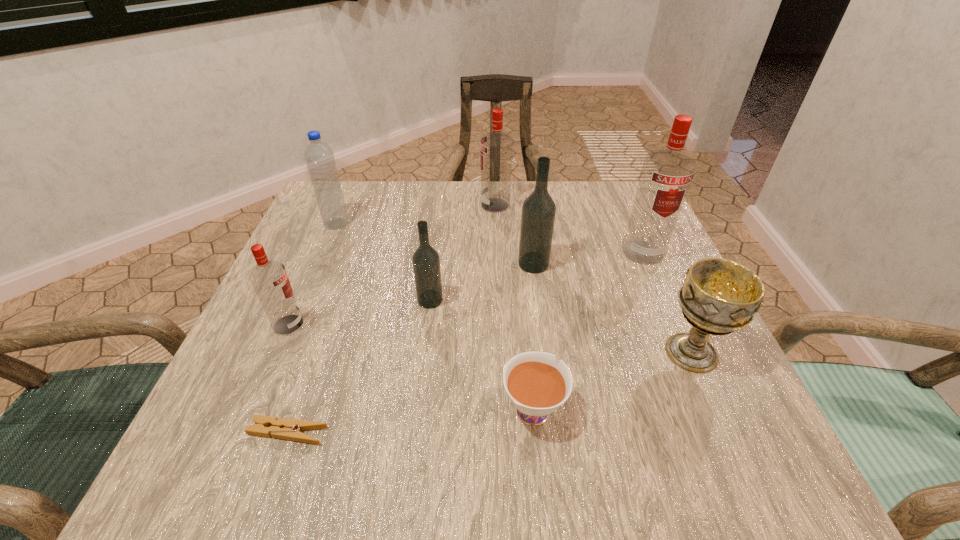
The image size is (960, 540). I want to click on the left black vodka, so click(426, 262).

You are a GUI agent. You are given a task and a screenshot of the screen. Output one action in this format:
    pyautogui.click(x=<x>, y=<y>)
    Task: Click on the second nearest vodka
    
    Given the screenshot: What is the action you would take?
    pyautogui.click(x=426, y=262)

Locate an element on the screen. This screenshot has height=540, width=960. white chalice is located at coordinates (719, 296).

You are a GUI agent. You are given a task and a screenshot of the screen. Output one action in this format:
    pyautogui.click(x=<x>, y=<y>)
    Task: Click on the white teacup
    
    Given the screenshot: What is the action you would take?
    tap(537, 387)

This screenshot has width=960, height=540. In order to click on the second shortest object in this screenshot , I will do `click(537, 387)`.

Where is `the shortest object`? The width and height of the screenshot is (960, 540). the shortest object is located at coordinates (283, 428).

Find the location of a particular element. free point located on the front label of the rightmost red vodka is located at coordinates (693, 368).

Find the location of a particular element. Image resolution: width=960 pixels, height=540 pixels. free space located 0.210m on the back of the bigger black vodka is located at coordinates (525, 201).

At what (x,y) coordinates should I click in order to perform the action: click on free space located 0.270m on the front label of the farthest vodka. Please return your answer as a coordinate pair (x, y). Image resolution: width=960 pixels, height=540 pixels. Looking at the image, I should click on (372, 205).

At what (x,y) coordinates should I click in order to perform the action: click on free space located on the front label of the farthest vodka. Please return your answer as a coordinate pair (x, y). This screenshot has height=540, width=960. Looking at the image, I should click on (404, 205).